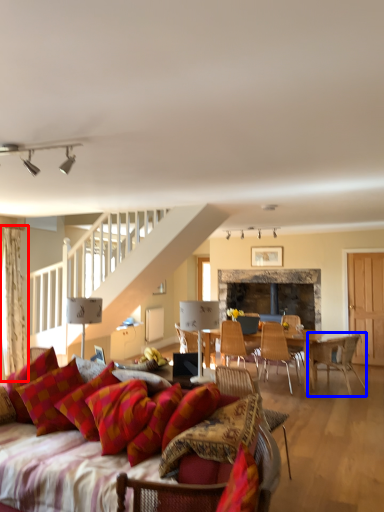
Question: Which object appears farthest to the camera in this image, curtain (highlighted by a red box) or chair (highlighted by a blue box)?

Choices:
 (A) curtain
 (B) chair

Answer: (B)